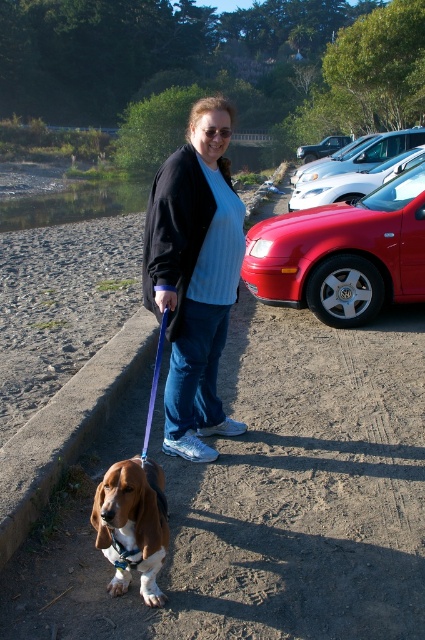
Question: Can you confirm if shiny red car at right is positioned below brown and white fur at lower left?

Choices:
 (A) no
 (B) yes

Answer: (A)

Question: Can you confirm if shiny red car at right is bigger than brown and white fur at lower left?

Choices:
 (A) no
 (B) yes

Answer: (B)

Question: Estimate the real-world distances between objects in this image. Which object is farther from the shiny red car at right?

Choices:
 (A) satin silver sedan at right
 (B) brown and white fur at lower left
 (C) matte black jacket at center

Answer: (B)

Question: Where is matte black jacket at center located in relation to brown and white fur at lower left in the image?

Choices:
 (A) above
 (B) below

Answer: (A)

Question: Which object is farther from the camera taking this photo?

Choices:
 (A) shiny red car at right
 (B) brown and white fur at lower left

Answer: (A)

Question: Among these objects, which one is nearest to the camera?

Choices:
 (A) brown and white fur at lower left
 (B) shiny red car at right
 (C) satin silver sedan at right

Answer: (A)